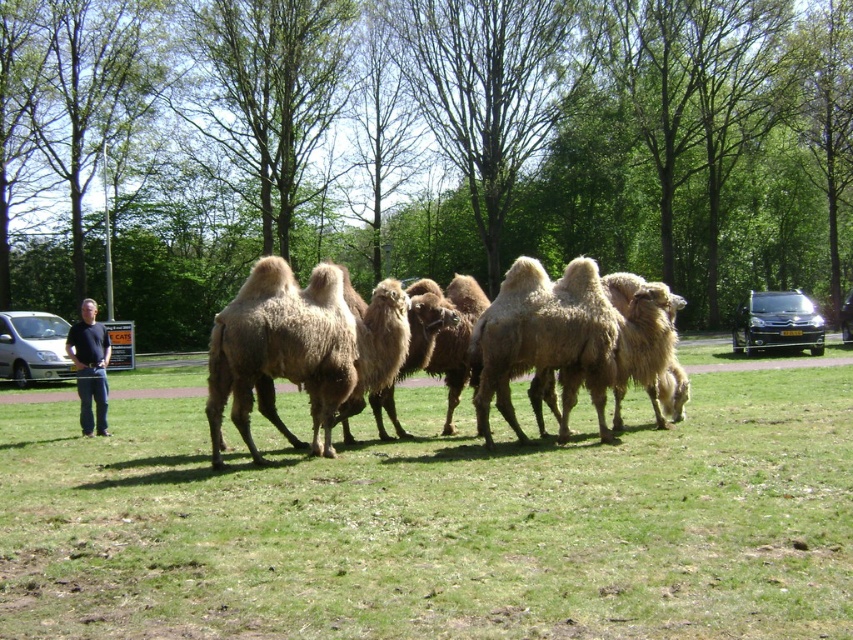
You are a photographer standing in front of the fuzzy beige camels at center. You want to take a photo of them but need to ensure you are far enough away to capture all of them in the frame. If your camera has a maximum focus range of 5 meters, will you be able to take the photo from your current position?

The distance between you and the fuzzy beige camels at center is 4.91 meters, which is within the camera maximum focus range of 5 meters. Therefore, you can take the photo from your current position.

You are a photographer trying to capture both the black metallic car at right and the black shirt at left in a single frame. Since the car is larger, will you need to adjust your camera position to include both?

The black metallic car at right is bigger than the black shirt at left. To include both in a single frame, you might need to adjust your camera position to ensure the larger car doesn

You are a photographer trying to capture the brown fuzzy camel at center in your shot. Based on its 2D coordinates, where should you aim your camera?

The brown fuzzy camel at center is located at the 2D coordinates point (x=302, y=348), so aim your camera there to capture it.